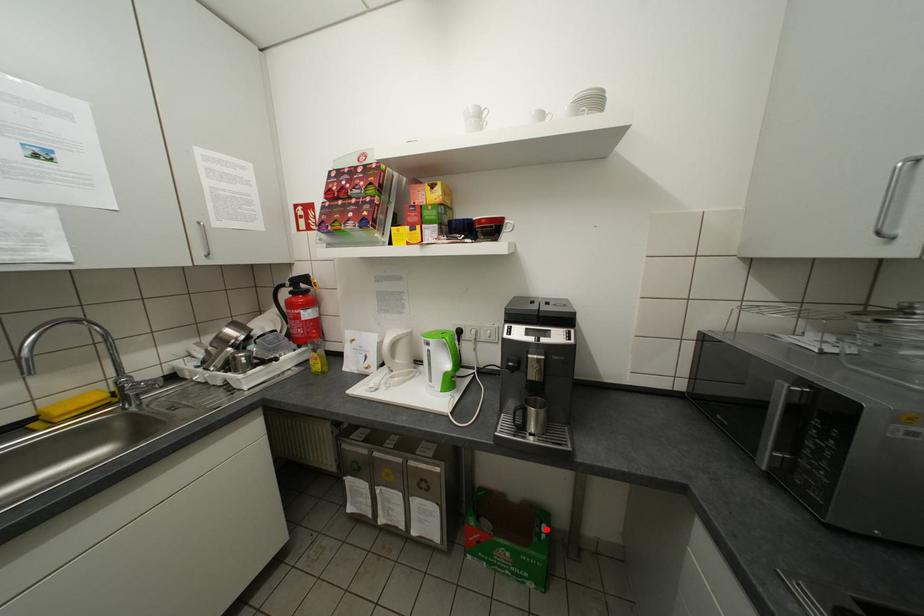
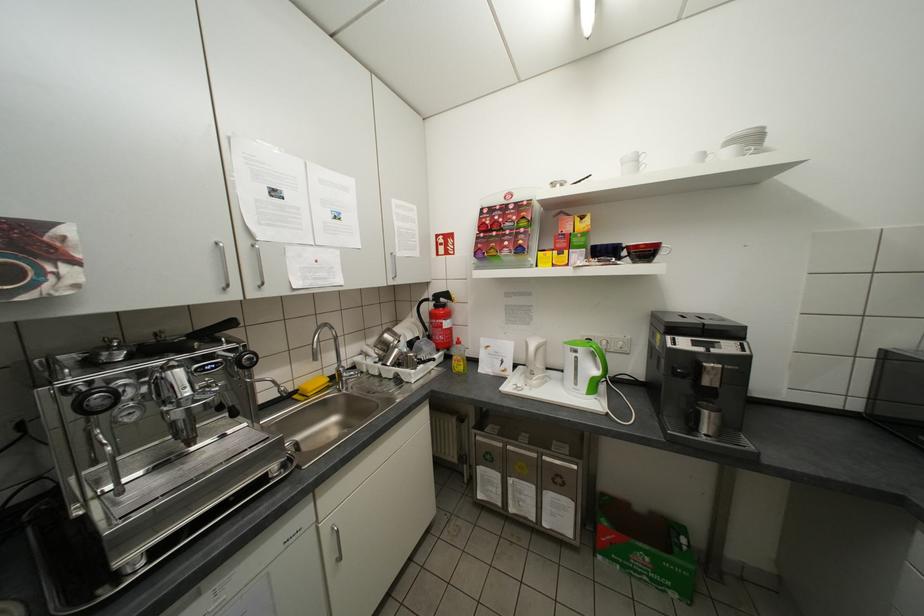
The point at the highlighted location is marked in the first image. Where is the corresponding point in the second image?

(685, 541)